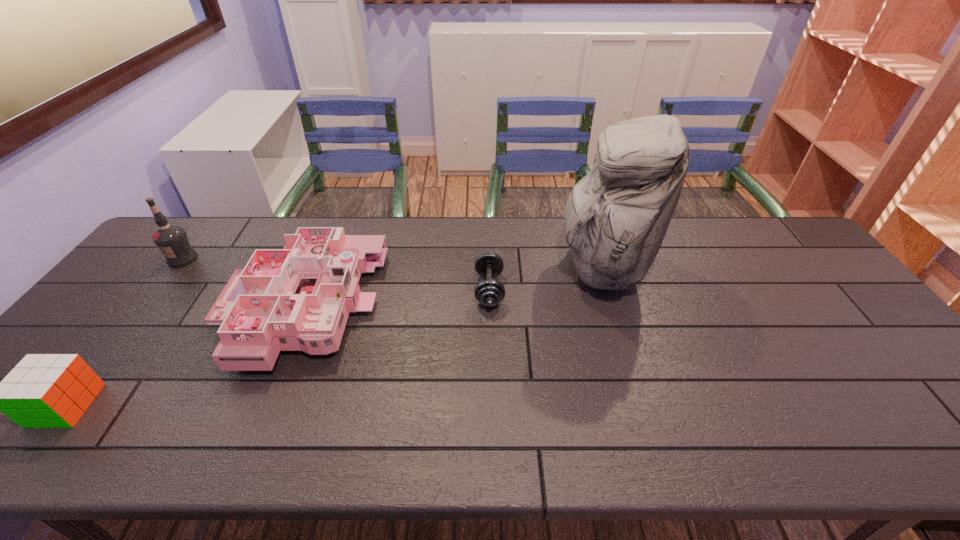
Locate an element on the screen. This screenshot has height=540, width=960. the tallest object is located at coordinates (615, 219).

Locate an element on the screen. The height and width of the screenshot is (540, 960). the rightmost object is located at coordinates (615, 219).

Where is `the fourth shortest object`? The image size is (960, 540). the fourth shortest object is located at coordinates (171, 239).

Locate an element on the screen. This screenshot has height=540, width=960. dollhouse is located at coordinates (298, 298).

Image resolution: width=960 pixels, height=540 pixels. I want to click on cube, so click(43, 390).

Find the location of a particular element. the shortest object is located at coordinates (489, 292).

Where is `the second object from right to left`? This screenshot has width=960, height=540. the second object from right to left is located at coordinates (489, 292).

Locate an element on the screen. free space located 0.300m on the front-facing side of the backpack is located at coordinates (458, 268).

Identify the location of vacant space located 0.280m on the front-facing side of the backpack. Image resolution: width=960 pixels, height=540 pixels. (465, 268).

This screenshot has width=960, height=540. I want to click on vacant space located on the front-facing side of the backpack, so 484,268.